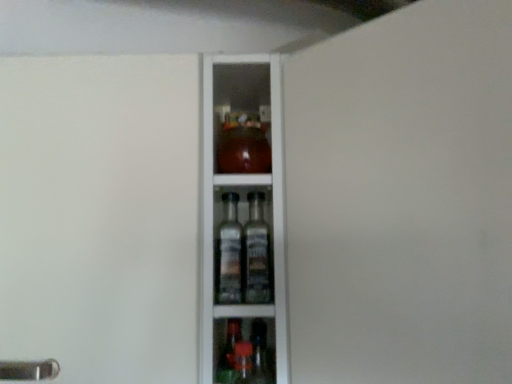
Question: Which direction should I rotate to look at transparent glass cabinet at center, placed as the second screen door when sorted from right to left?

Choices:
 (A) left
 (B) right

Answer: (A)

Question: Is transparent glass cabinet at center, the 1th screen door when ordered from right to left, surrounding transparent glass cabinet at center, placed as the second screen door when sorted from right to left?

Choices:
 (A) yes
 (B) no

Answer: (B)

Question: Does transparent glass cabinet at center, positioned as the second screen door in left-to-right order, have a larger size compared to transparent glass cabinet at center, placed as the 1th screen door when sorted from left to right?

Choices:
 (A) yes
 (B) no

Answer: (B)

Question: From a real-world perspective, does transparent glass cabinet at center, positioned as the second screen door in left-to-right order, sit lower than transparent glass cabinet at center, placed as the 1th screen door when sorted from left to right?

Choices:
 (A) no
 (B) yes

Answer: (B)

Question: From a real-world perspective, is transparent glass cabinet at center, the 1th screen door when ordered from right to left, on transparent glass cabinet at center, placed as the 1th screen door when sorted from left to right?

Choices:
 (A) no
 (B) yes

Answer: (A)

Question: Is transparent glass cabinet at center, positioned as the second screen door in left-to-right order, at the left side of transparent glass cabinet at center, placed as the 1th screen door when sorted from left to right?

Choices:
 (A) yes
 (B) no

Answer: (B)

Question: Would you consider transparent glass cabinet at center, the 1th screen door when ordered from right to left, to be distant from transparent glass cabinet at center, placed as the 1th screen door when sorted from left to right?

Choices:
 (A) yes
 (B) no

Answer: (B)

Question: Is there a large distance between transparent glass cabinet at center, placed as the second screen door when sorted from right to left, and transparent glass cabinet at center, positioned as the second screen door in left-to-right order?

Choices:
 (A) yes
 (B) no

Answer: (B)

Question: From the image's perspective, is transparent glass cabinet at center, placed as the 1th screen door when sorted from left to right, on top of transparent glass cabinet at center, positioned as the second screen door in left-to-right order?

Choices:
 (A) yes
 (B) no

Answer: (B)

Question: Does transparent glass cabinet at center, placed as the second screen door when sorted from right to left, have a greater width compared to transparent glass cabinet at center, positioned as the second screen door in left-to-right order?

Choices:
 (A) yes
 (B) no

Answer: (A)

Question: Is transparent glass cabinet at center, placed as the 1th screen door when sorted from left to right, not inside transparent glass cabinet at center, positioned as the second screen door in left-to-right order?

Choices:
 (A) yes
 (B) no

Answer: (A)

Question: From the image's perspective, is transparent glass cabinet at center, placed as the second screen door when sorted from right to left, below transparent glass cabinet at center, the 1th screen door when ordered from right to left?

Choices:
 (A) no
 (B) yes

Answer: (B)

Question: Is transparent glass cabinet at center, placed as the second screen door when sorted from right to left, closer to the viewer compared to transparent glass cabinet at center, the 1th screen door when ordered from right to left?

Choices:
 (A) yes
 (B) no

Answer: (B)

Question: Considering the positions of transparent glass cabinet at center, the 1th screen door when ordered from right to left, and transparent glass cabinet at center, placed as the 1th screen door when sorted from left to right, in the image, is transparent glass cabinet at center, the 1th screen door when ordered from right to left, taller or shorter than transparent glass cabinet at center, placed as the 1th screen door when sorted from left to right,?

Choices:
 (A) tall
 (B) short

Answer: (A)